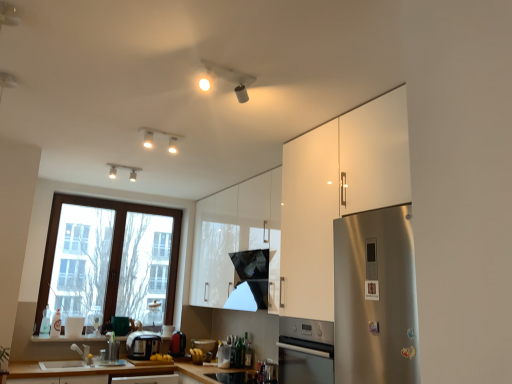
Question: Is satin silver toaster at center, the third appliance from the right, facing towards translucent glass bottle at center, the fourth bottle from the left?

Choices:
 (A) no
 (B) yes

Answer: (A)

Question: Can you confirm if satin silver toaster at center, the third appliance from the right, is shorter than translucent glass bottle at center, the fourth bottle from the left?

Choices:
 (A) no
 (B) yes

Answer: (A)

Question: From a real-world perspective, is satin silver toaster at center, which ranks as the 1th appliance in left-to-right order, under translucent glass bottle at center, the fourth bottle from the left?

Choices:
 (A) no
 (B) yes

Answer: (A)

Question: Can you confirm if satin silver toaster at center, the third appliance from the right, is bigger than translucent glass bottle at center, arranged as the 1th bottle when viewed from the right?

Choices:
 (A) no
 (B) yes

Answer: (B)

Question: Can translucent glass bottle at center, the fourth bottle from the left, be found inside satin silver toaster at center, which ranks as the 1th appliance in left-to-right order?

Choices:
 (A) yes
 (B) no

Answer: (B)

Question: Is satin silver toaster at center, the third appliance from the right, positioned in front of translucent glass bottle at center, the fourth bottle from the left?

Choices:
 (A) yes
 (B) no

Answer: (B)

Question: Is white glossy cabinet at right, marked as the 2th cabinetry in a back-to-front arrangement, far away from translucent plastic bottle at window, the 3th bottle from the right?

Choices:
 (A) yes
 (B) no

Answer: (A)

Question: Can you confirm if white glossy cabinet at right, marked as the 2th cabinetry in a back-to-front arrangement, is smaller than translucent plastic bottle at window, which appears as the second bottle when viewed from the left?

Choices:
 (A) no
 (B) yes

Answer: (A)

Question: Considering the relative positions of white glossy cabinet at right, marked as the 2th cabinetry in a back-to-front arrangement, and translucent plastic bottle at window, which appears as the second bottle when viewed from the left, in the image provided, is white glossy cabinet at right, marked as the 2th cabinetry in a back-to-front arrangement, behind translucent plastic bottle at window, which appears as the second bottle when viewed from the left,?

Choices:
 (A) no
 (B) yes

Answer: (A)

Question: Considering the relative sizes of white glossy cabinet at right, the first cabinetry when ordered from front to back, and translucent plastic bottle at window, the 3th bottle from the right, in the image provided, is white glossy cabinet at right, the first cabinetry when ordered from front to back, bigger than translucent plastic bottle at window, the 3th bottle from the right,?

Choices:
 (A) no
 (B) yes

Answer: (B)

Question: From the image's perspective, is white glossy cabinet at right, marked as the 2th cabinetry in a back-to-front arrangement, located beneath translucent plastic bottle at window, the 3th bottle from the right?

Choices:
 (A) yes
 (B) no

Answer: (B)

Question: From a real-world perspective, is white glossy cabinet at right, marked as the 2th cabinetry in a back-to-front arrangement, beneath translucent plastic bottle at window, the 3th bottle from the right?

Choices:
 (A) no
 (B) yes

Answer: (A)

Question: From the image's perspective, is translucent plastic bottle at window, the 3th bottle from the right, on satin silver toaster at center, which ranks as the 1th appliance in left-to-right order?

Choices:
 (A) yes
 (B) no

Answer: (A)